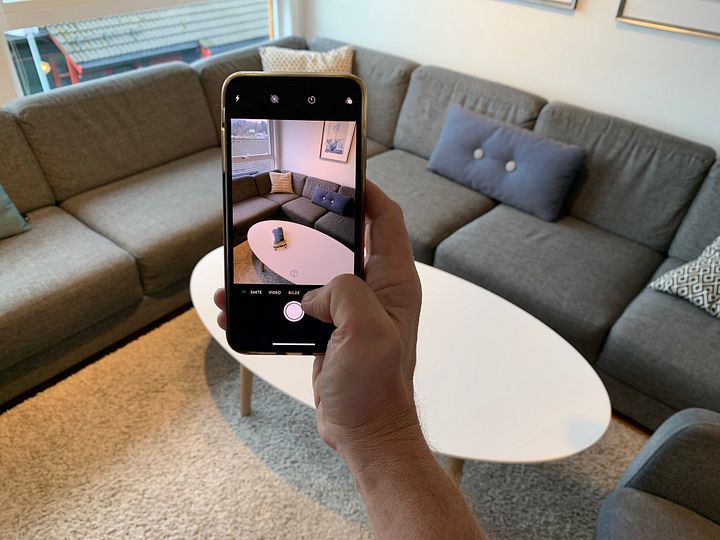
What are the coordinates of `off white picture` in the screenshot? It's located at (667, 11).